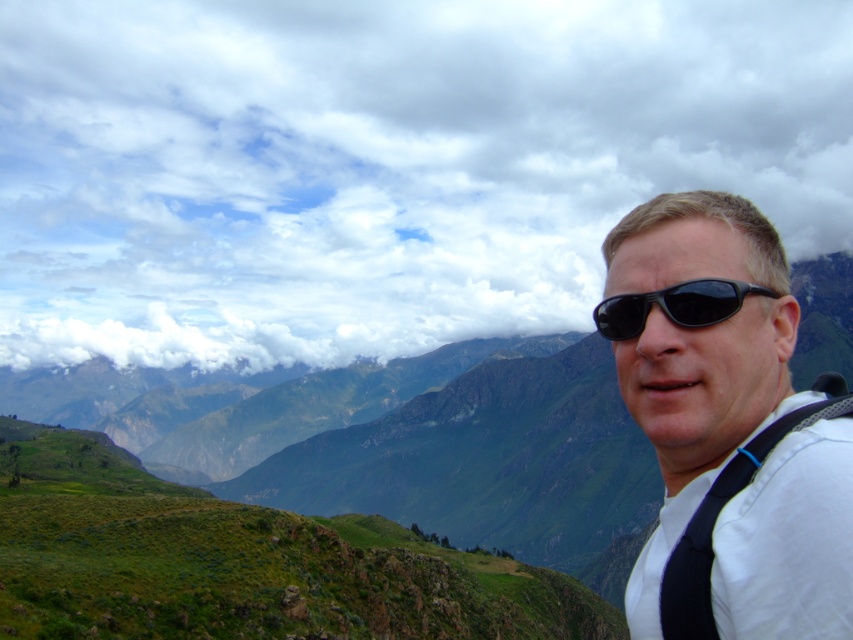
Between matte black sunglasses at right and black matte sunglasses at center, which one is positioned lower?

matte black sunglasses at right

Can you confirm if matte black sunglasses at right is smaller than black matte sunglasses at center?

No, matte black sunglasses at right is not smaller than black matte sunglasses at center.

Which is behind, point (650, 547) or point (722, 282)?

The point (650, 547) is behind.

Locate an element on the screen. matte black sunglasses at right is located at coordinates (695, 349).

Can you confirm if cloudy sky at upper center is thinner than black fabric strap at right?

In fact, cloudy sky at upper center might be wider than black fabric strap at right.

Who is more distant from viewer, (682, 164) or (753, 461)?

The point (682, 164) is behind.

Identify the location of cloudy sky at upper center. This screenshot has width=853, height=640. (381, 164).

At what (x,y) coordinates should I click in order to perform the action: click on cloudy sky at upper center. Please return your answer as a coordinate pair (x, y). This screenshot has width=853, height=640. Looking at the image, I should click on (381, 164).

How distant is cloudy sky at upper center from black matte sunglasses at center?

cloudy sky at upper center and black matte sunglasses at center are 716.75 meters apart from each other.

Where is `cloudy sky at upper center`? cloudy sky at upper center is located at coordinates pyautogui.click(x=381, y=164).